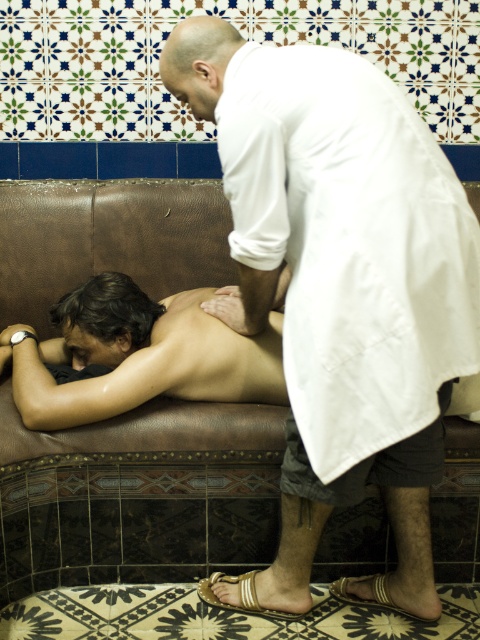
Question: Does white matte robe at center have a smaller size compared to brown leather couch at center?

Choices:
 (A) no
 (B) yes

Answer: (A)

Question: Which point is farther to the camera?

Choices:
 (A) (395, 332)
 (B) (6, 432)

Answer: (B)

Question: Which of the following is the closest to the observer?

Choices:
 (A) brown leather couch at center
 (B) white matte robe at center

Answer: (B)

Question: Can you confirm if white matte robe at center is smaller than brown leather couch at center?

Choices:
 (A) no
 (B) yes

Answer: (A)

Question: Which object appears closest to the camera in this image?

Choices:
 (A) white matte robe at center
 (B) brown leather couch at center

Answer: (A)

Question: Is white matte robe at center wider than brown leather couch at center?

Choices:
 (A) no
 (B) yes

Answer: (A)